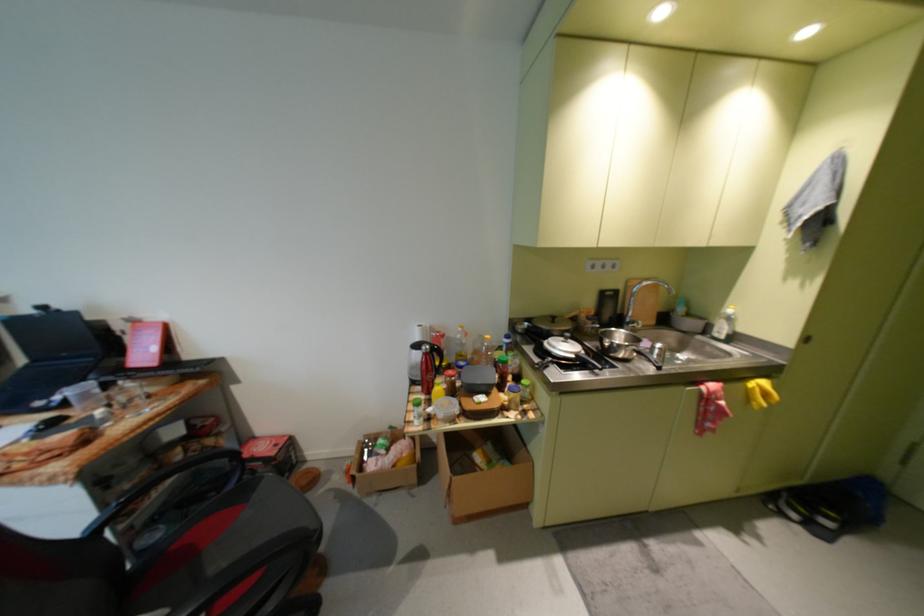
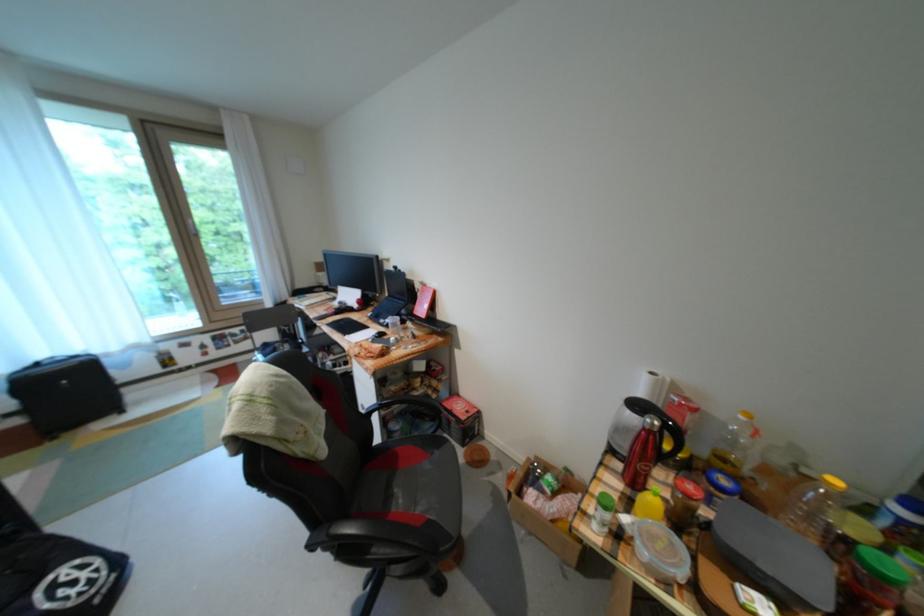
The point at [430,379] is marked in the first image. Where is the corresponding point in the second image?

(636, 455)